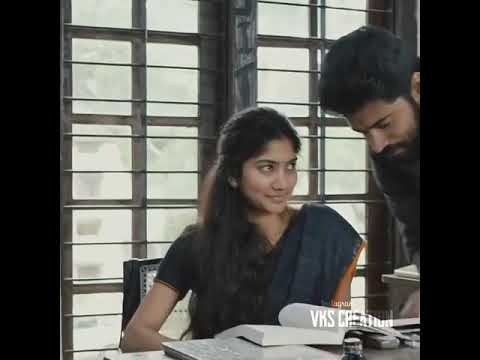
Locate an element on the screen. This screenshot has width=480, height=360. chair is located at coordinates (141, 279).